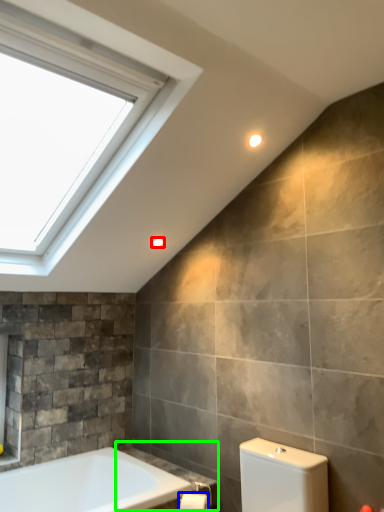
Question: Which is farther away from light fixture (highlighted by a red box)? toilet paper (highlighted by a blue box) or counter top (highlighted by a green box)?

Choices:
 (A) toilet paper
 (B) counter top

Answer: (A)